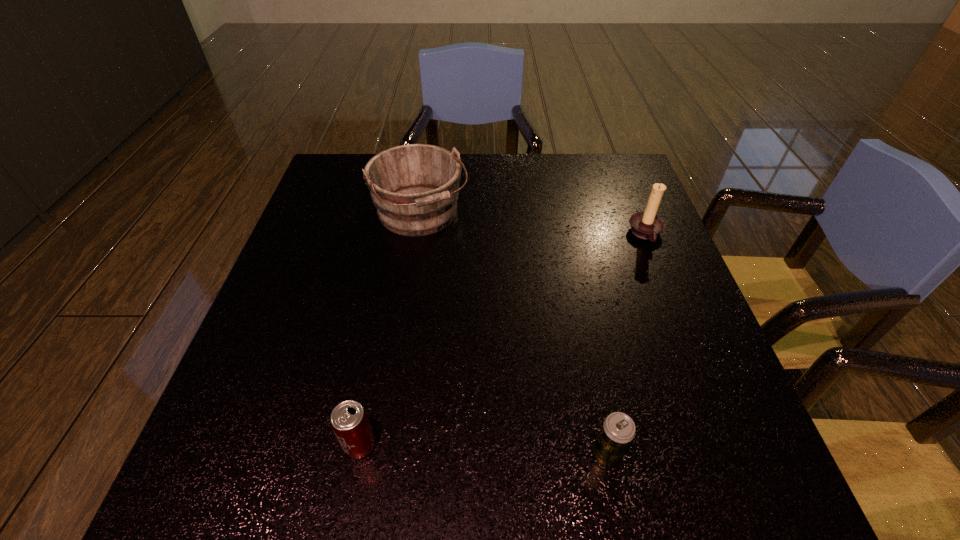
The width and height of the screenshot is (960, 540). What are the coordinates of `wine bucket` in the screenshot? It's located at (415, 188).

The image size is (960, 540). Find the location of `candle holder`. candle holder is located at coordinates (647, 225).

At what (x,y) coordinates should I click in order to perform the action: click on the left beer can. Please return your answer as a coordinate pair (x, y). This screenshot has width=960, height=540. Looking at the image, I should click on (349, 421).

Locate an element on the screen. The image size is (960, 540). the right beer can is located at coordinates coord(618,430).

Locate an element on the screen. This screenshot has width=960, height=540. vacant space located 0.060m on the right of the wine bucket is located at coordinates (492, 214).

The height and width of the screenshot is (540, 960). I want to click on vacant position located 0.380m on the wick of the rightmost object, so click(480, 234).

You are a GUI agent. You are given a task and a screenshot of the screen. Output one action in this format:
    pyautogui.click(x=<x>, y=<y>)
    Task: Click on the vacant area situated 0.080m on the wick of the rightmost object
    Image resolution: width=960 pixels, height=540 pixels.
    Given the screenshot: What is the action you would take?
    pyautogui.click(x=597, y=234)

The image size is (960, 540). In order to click on vacant area situated on the wick of the rightmost object in this screenshot , I will do `click(500, 234)`.

You are a GUI agent. You are given a task and a screenshot of the screen. Output one action in this format:
    pyautogui.click(x=<x>, y=<y>)
    Task: Click on the vacant space located on the right of the left beer can
    
    Given the screenshot: What is the action you would take?
    pyautogui.click(x=465, y=445)

At what (x,y) coordinates should I click in order to perform the action: click on vacant area located on the left of the second object from right to left. Please return your answer as a coordinate pair (x, y). Looking at the image, I should click on (509, 455).